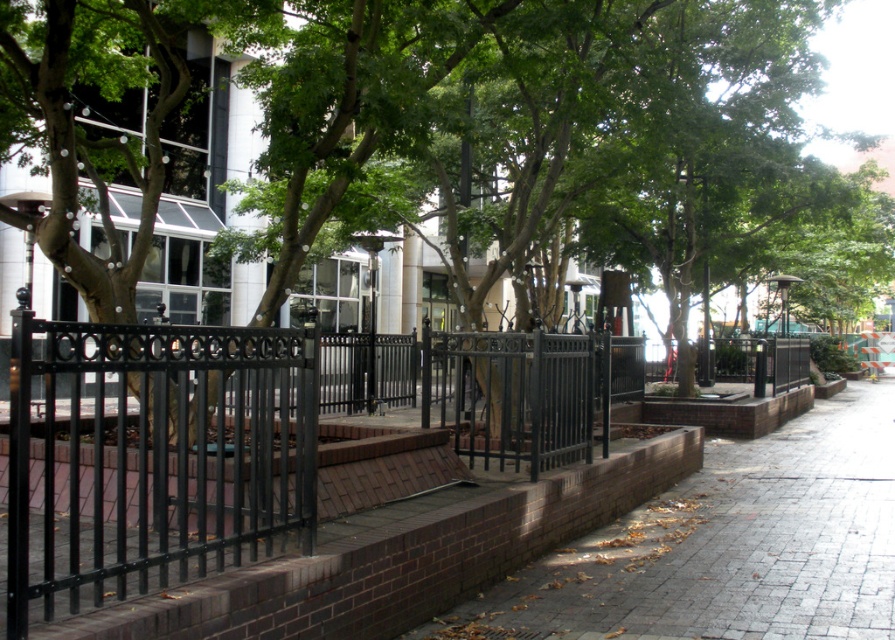
You are a landscape architect designing a pathway. You have two sections of black wrought iron fence available. One is labeled as the black wrought iron fence at center and the other as the black wrought iron fence at left. Which section should you choose if you need a wider fence to separate the walkway from the planters?

The black wrought iron fence at center should be chosen because its width is larger than the black wrought iron fence at left, making it suitable for the wider separation needed between the walkway and the planters.

You are a maintenance worker checking the walkway. You see the green leafy tree at center and the brick pavement at center. Which object is positioned higher relative to the other?

The green leafy tree at center is located above the brick pavement at center, so it is positioned higher.